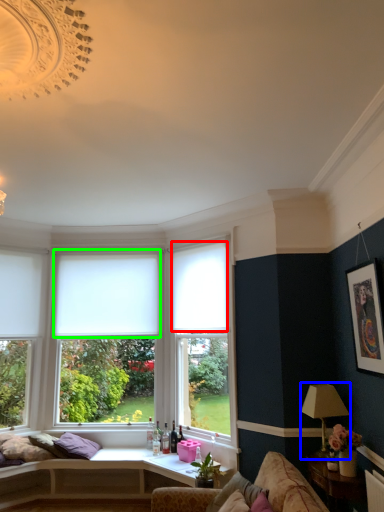
Question: Considering the real-world distances, which object is farthest from curtain (highlighted by a red box)? lamp (highlighted by a blue box) or blind (highlighted by a green box)?

Choices:
 (A) lamp
 (B) blind

Answer: (A)